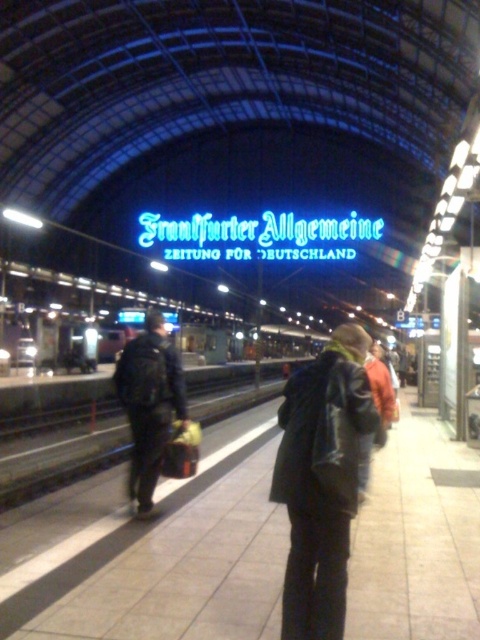
Which is more to the right, leather jacket at center or dark blue leather jacket at center?

From the viewer's perspective, leather jacket at center appears more on the right side.

The width and height of the screenshot is (480, 640). What do you see at coordinates (322, 481) in the screenshot? I see `leather jacket at center` at bounding box center [322, 481].

Where is `leather jacket at center`? The height and width of the screenshot is (640, 480). leather jacket at center is located at coordinates (322, 481).